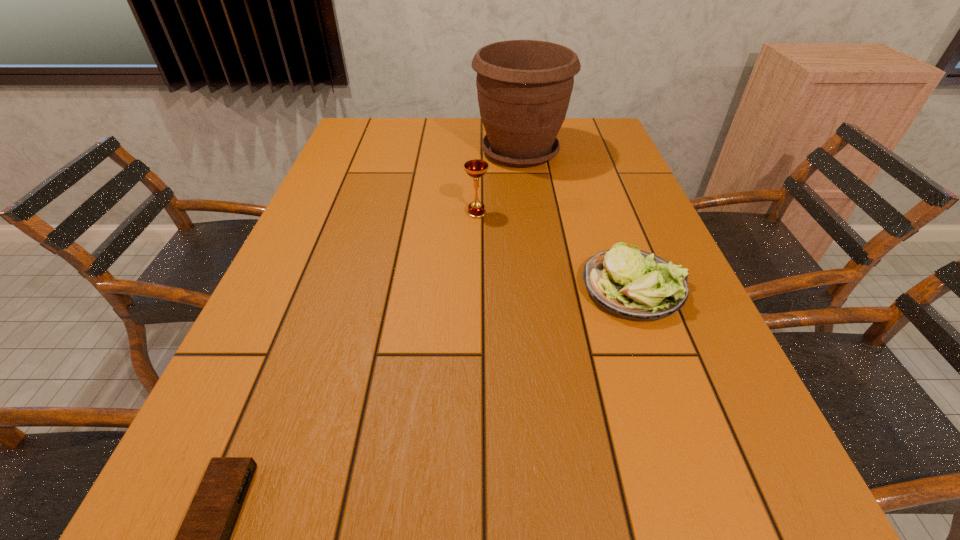
Where is `object that is positioned at the right edge`? The image size is (960, 540). object that is positioned at the right edge is located at coordinates (632, 284).

The width and height of the screenshot is (960, 540). Find the location of `vacant space at the far edge of the desktop`. vacant space at the far edge of the desktop is located at coordinates (440, 139).

This screenshot has width=960, height=540. In the image, there is a desktop. Find the location of `vacant space at the near edge`. vacant space at the near edge is located at coordinates click(288, 537).

Find the location of a particular element. The width and height of the screenshot is (960, 540). vacant area at the left edge of the desktop is located at coordinates (349, 179).

Where is `vacant space at the right edge of the desktop`? The width and height of the screenshot is (960, 540). vacant space at the right edge of the desktop is located at coordinates (703, 341).

You are a GUI agent. You are given a task and a screenshot of the screen. Output one action in this format:
    pyautogui.click(x=<x>, y=<y>)
    Task: Click on the vacant region between the flowerpot and the chalice
    This screenshot has height=540, width=960.
    Given the screenshot: What is the action you would take?
    pyautogui.click(x=498, y=183)

Image resolution: width=960 pixels, height=540 pixels. I want to click on free space that is in between the flowerpot and the lettuce, so click(577, 220).

Image resolution: width=960 pixels, height=540 pixels. In order to click on empty location between the third tallest object and the tallest object in this screenshot , I will do `click(577, 220)`.

Identify the location of free area in between the third shortest object and the lettuce. The image size is (960, 540). (555, 251).

The height and width of the screenshot is (540, 960). What are the coordinates of `vacant area that lies between the third farthest object and the farthest object` in the screenshot? It's located at (577, 220).